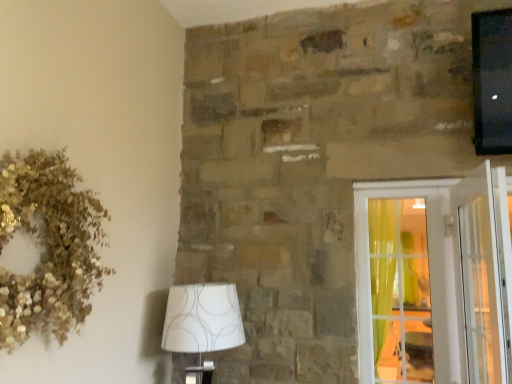
Where is `white fabric lampshade at lower left`? The height and width of the screenshot is (384, 512). white fabric lampshade at lower left is located at coordinates coord(202,323).

Find the location of `clear glass door at right`. clear glass door at right is located at coordinates (433, 280).

What do you see at coordinates (48, 246) in the screenshot? I see `gold glitter wreath at upper left` at bounding box center [48, 246].

Measure the distance between clear glass screen door at right and camera.

The distance of clear glass screen door at right from camera is 1.47 meters.

Locate an element on the screen. Image resolution: width=512 pixels, height=384 pixels. white fabric lampshade at lower left is located at coordinates (202, 323).

Which of these two, clear glass screen door at right or gold glitter wreath at upper left, is wider?

Wider between the two is gold glitter wreath at upper left.

Considering the points (488, 198) and (85, 262), which point is behind, point (488, 198) or point (85, 262)?

The point (85, 262) is behind.

Visually, is clear glass screen door at right positioned to the left or to the right of gold glitter wreath at upper left?

clear glass screen door at right is to the right of gold glitter wreath at upper left.

Locate an element on the screen. The height and width of the screenshot is (384, 512). screen door behind the gold glitter wreath at upper left is located at coordinates (481, 293).

From a real-world perspective, is clear glass door at right located beneath white fabric lampshade at lower left?

No, from a real-world perspective, clear glass door at right is not under white fabric lampshade at lower left.

Can you tell me how much clear glass door at right and white fabric lampshade at lower left differ in facing direction?

The angle between the facing direction of clear glass door at right and the facing direction of white fabric lampshade at lower left is 90 degrees.

Between clear glass door at right and white fabric lampshade at lower left, which one has more height?

Standing taller between the two is clear glass door at right.

Image resolution: width=512 pixels, height=384 pixels. In order to click on lamp located behind the clear glass screen door at right in this screenshot , I will do `click(202, 323)`.

Could you tell me if white fabric lampshade at lower left is turned towards clear glass screen door at right?

Yes, white fabric lampshade at lower left is oriented towards clear glass screen door at right.

Consider the image. In the image, is white fabric lampshade at lower left positioned in front of or behind clear glass screen door at right?

In the image, white fabric lampshade at lower left appears behind clear glass screen door at right.

From a real-world perspective, is white fabric lampshade at lower left physically below clear glass screen door at right?

Yes, from a real-world perspective, white fabric lampshade at lower left is below clear glass screen door at right.

From the image's perspective, is gold glitter wreath at upper left beneath clear glass screen door at right?

Actually, gold glitter wreath at upper left appears above clear glass screen door at right in the image.

Is gold glitter wreath at upper left facing away from clear glass screen door at right?

No, gold glitter wreath at upper left's orientation is not away from clear glass screen door at right.

The height and width of the screenshot is (384, 512). In order to click on screen door that appears behind the gold glitter wreath at upper left in this screenshot , I will do `click(481, 293)`.

Which is behind, point (393, 335) or point (495, 278)?

Point (393, 335)

From the image's perspective, between clear glass door at right and clear glass screen door at right, who is located below?

clear glass door at right is shown below in the image.

Is clear glass door at right not close to clear glass screen door at right?

clear glass door at right is actually quite close to clear glass screen door at right.

From a real-world perspective, between clear glass door at right and clear glass screen door at right, who is vertically lower?

In real-world perspective, clear glass door at right is lower.

In the scene shown: Between gold glitter wreath at upper left and clear glass door at right, which one is positioned behind?

clear glass door at right is further from the camera.

In terms of height, does gold glitter wreath at upper left look taller or shorter compared to clear glass door at right?

In the image, gold glitter wreath at upper left appears to be shorter than clear glass door at right.

Is gold glitter wreath at upper left positioned far away from clear glass door at right?

Absolutely, gold glitter wreath at upper left is distant from clear glass door at right.

Is point (93, 221) closer or farther from the camera than point (378, 265)?

Point (93, 221) is positioned closer to the camera compared to point (378, 265).

Is clear glass screen door at right facing towards white fabric lampshade at lower left?

No, clear glass screen door at right does not turn towards white fabric lampshade at lower left.

Who is smaller, clear glass screen door at right or white fabric lampshade at lower left?

With smaller size is white fabric lampshade at lower left.

Would you say clear glass screen door at right is a long distance from white fabric lampshade at lower left?

Yes, clear glass screen door at right is far from white fabric lampshade at lower left.

At what (x,y) coordinates should I click in order to perform the action: click on screen door lying below the gold glitter wreath at upper left (from the image's perspective). Please return your answer as a coordinate pair (x, y). Looking at the image, I should click on (481, 293).

Locate an element on the screen. The height and width of the screenshot is (384, 512). window above the white fabric lampshade at lower left (from the image's perspective) is located at coordinates (433, 280).

From the image, which object appears to be farther from clear glass screen door at right, clear glass door at right or gold glitter wreath at upper left?

gold glitter wreath at upper left is further to clear glass screen door at right.

From the image, which object appears to be farther from clear glass door at right, clear glass screen door at right or gold glitter wreath at upper left?

The object further to clear glass door at right is gold glitter wreath at upper left.

Estimate the real-world distances between objects in this image. Which object is further from clear glass door at right, gold glitter wreath at upper left or white fabric lampshade at lower left?

Based on the image, gold glitter wreath at upper left appears to be further to clear glass door at right.

Which object lies nearer to the anchor point clear glass door at right, clear glass screen door at right or white fabric lampshade at lower left?

clear glass screen door at right lies closer to clear glass door at right than the other object.

Considering their positions, is white fabric lampshade at lower left positioned closer to clear glass door at right than gold glitter wreath at upper left?

Among the two, white fabric lampshade at lower left is located nearer to clear glass door at right.

Looking at the image, which one is located closer to white fabric lampshade at lower left, clear glass door at right or clear glass screen door at right?

Among the two, clear glass door at right is located nearer to white fabric lampshade at lower left.

From the image, which object appears to be farther from clear glass screen door at right, gold glitter wreath at upper left or clear glass door at right?

The object further to clear glass screen door at right is gold glitter wreath at upper left.

Based on their spatial positions, is gold glitter wreath at upper left or clear glass screen door at right closer to white fabric lampshade at lower left?

gold glitter wreath at upper left lies closer to white fabric lampshade at lower left than the other object.

This screenshot has width=512, height=384. I want to click on lamp between gold glitter wreath at upper left and clear glass screen door at right from left to right, so click(x=202, y=323).

The image size is (512, 384). Find the location of `window located between gold glitter wreath at upper left and clear glass screen door at right in the left-right direction`. window located between gold glitter wreath at upper left and clear glass screen door at right in the left-right direction is located at coordinates (433, 280).

This screenshot has height=384, width=512. I want to click on window between white fabric lampshade at lower left and clear glass screen door at right in the horizontal direction, so click(x=433, y=280).

Identify the location of lamp between gold glitter wreath at upper left and clear glass door at right in the horizontal direction. (202, 323).